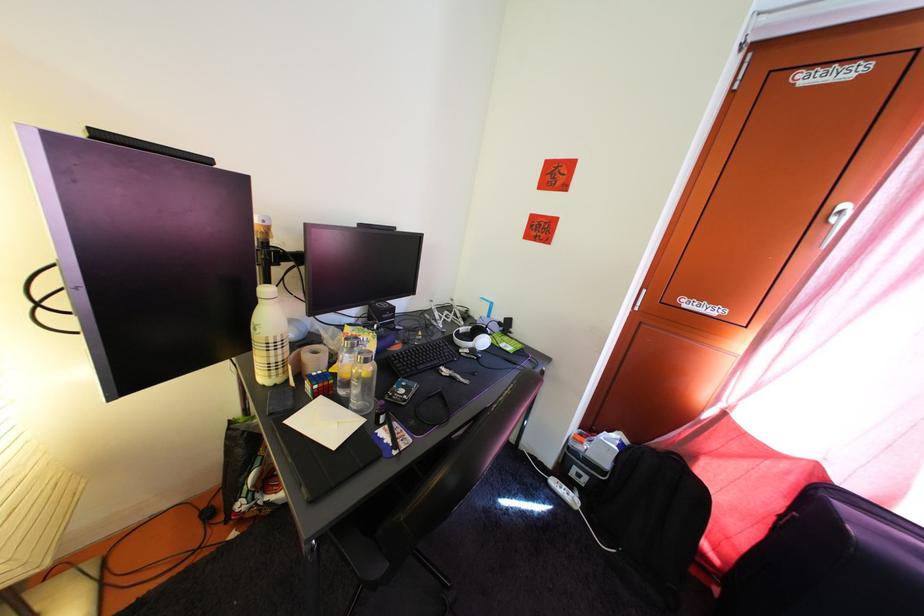
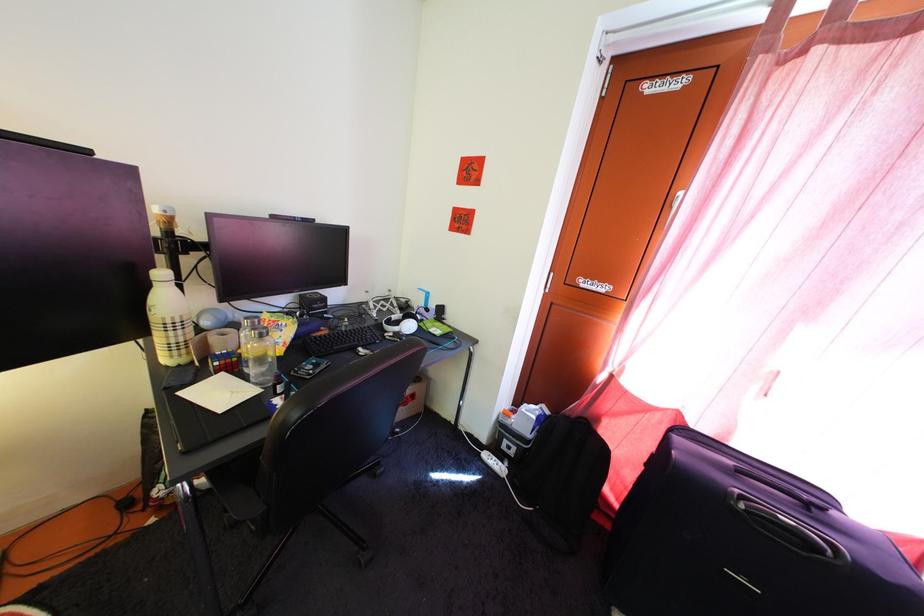
Locate, in the second image, the point that corresponds to [557,480] in the first image.

(492, 456)